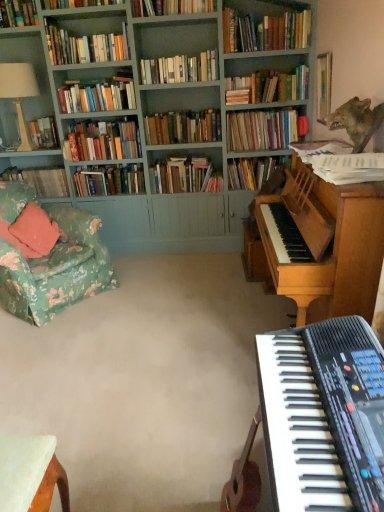
The image size is (384, 512). What do you see at coordinates (340, 162) in the screenshot?
I see `white paper at upper right, acting as the 1th book starting from the front` at bounding box center [340, 162].

The width and height of the screenshot is (384, 512). Find the location of `hardcover books at upper left, marked as the 11th book in a back-to-front arrangement`. hardcover books at upper left, marked as the 11th book in a back-to-front arrangement is located at coordinates (85, 46).

Image resolution: width=384 pixels, height=512 pixels. I want to click on hardcover book at left, which ranks as the first book in back-to-front order, so click(x=41, y=180).

Where is `hardcover book at center, marked as the eleventh book in a front-to-back arrangement`? Image resolution: width=384 pixels, height=512 pixels. hardcover book at center, marked as the eleventh book in a front-to-back arrangement is located at coordinates (253, 172).

Looking at this image, is white ceramic lamp at upper left with hardcover books at center, which ranks as the 6th book in front-to-back order?

No, white ceramic lamp at upper left is not beside hardcover books at center, which ranks as the 6th book in front-to-back order.

Is white ceramic lamp at upper left oriented towards hardcover books at center, which ranks as the 6th book in front-to-back order?

No.

Considering the relative sizes of white ceramic lamp at upper left and hardcover books at center, which is counted as the 9th book, starting from the back, in the image provided, is white ceramic lamp at upper left thinner than hardcover books at center, which is counted as the 9th book, starting from the back,?

In fact, white ceramic lamp at upper left might be wider than hardcover books at center, which is counted as the 9th book, starting from the back.

From the image's perspective, who appears lower, white ceramic lamp at upper left or hardcover books at center, which is counted as the 9th book, starting from the back?

white ceramic lamp at upper left, from the image's perspective.

In terms of width, does light brown polished wood piano at right look wider or thinner when compared to hardcover books at center, the tenth book viewed from the front?

light brown polished wood piano at right is wider than hardcover books at center, the tenth book viewed from the front.

Can you confirm if light brown polished wood piano at right is bigger than hardcover books at center, positioned as the 5th book in back-to-front order?

Yes, light brown polished wood piano at right is bigger than hardcover books at center, positioned as the 5th book in back-to-front order.

How many degrees apart are the facing directions of light brown polished wood piano at right and hardcover books at center, positioned as the 5th book in back-to-front order?

light brown polished wood piano at right and hardcover books at center, positioned as the 5th book in back-to-front order, are facing 91.1 degrees away from each other.

Is hardcover books at center, positioned as the 5th book in back-to-front order, surrounded by light brown polished wood piano at right?

No, light brown polished wood piano at right does not contain hardcover books at center, positioned as the 5th book in back-to-front order.

Consider the image. Which is closer, (x=298, y=173) or (x=149, y=9)?

Point (x=298, y=173) is positioned closer to the camera compared to point (x=149, y=9).

Is light brown polished wood piano at right wider than hardcover books at upper center, the 12th book in the back-to-front sequence?

Indeed, light brown polished wood piano at right has a greater width compared to hardcover books at upper center, the 12th book in the back-to-front sequence.

Is hardcover books at upper center, the third book viewed from the front, completely or partially inside light brown polished wood piano at right?

That's incorrect, hardcover books at upper center, the third book viewed from the front, is not inside light brown polished wood piano at right.

From the image's perspective, is light brown polished wood piano at right located above hardcover books at upper center, the third book viewed from the front?

No, from the image's perspective, light brown polished wood piano at right is not on top of hardcover books at upper center, the third book viewed from the front.

From a real-world perspective, is hardcover books at upper center, marked as the 7th book in a back-to-front arrangement, physically located above or below hardcover books at center, which is counted as the 9th book, starting from the back?

From a real-world perspective, hardcover books at upper center, marked as the 7th book in a back-to-front arrangement, is physically below hardcover books at center, which is counted as the 9th book, starting from the back.

Does hardcover books at upper center, which is the 8th book from front to back, have a lesser height compared to hardcover books at center, which ranks as the 6th book in front-to-back order?

Incorrect, the height of hardcover books at upper center, which is the 8th book from front to back, does not fall short of that of hardcover books at center, which ranks as the 6th book in front-to-back order.

Which is behind, hardcover books at upper center, which is the 8th book from front to back, or hardcover books at center, which ranks as the 6th book in front-to-back order?

hardcover books at upper center, which is the 8th book from front to back.

Is hardcover books at upper center, which is the 8th book from front to back, surrounding hardcover books at center, which is counted as the 9th book, starting from the back?

That's incorrect, hardcover books at center, which is counted as the 9th book, starting from the back, is not inside hardcover books at upper center, which is the 8th book from front to back.

How many degrees apart are the facing directions of hardcover book at center, marked as the eleventh book in a front-to-back arrangement, and hardcover books at upper left, the 9th book positioned from the front?

The angular difference between hardcover book at center, marked as the eleventh book in a front-to-back arrangement, and hardcover books at upper left, the 9th book positioned from the front, is 1.8 degrees.

Considering the relative sizes of hardcover book at center, marked as the eleventh book in a front-to-back arrangement, and hardcover books at upper left, the 9th book positioned from the front, in the image provided, is hardcover book at center, marked as the eleventh book in a front-to-back arrangement, wider than hardcover books at upper left, the 9th book positioned from the front,?

Indeed, hardcover book at center, marked as the eleventh book in a front-to-back arrangement, has a greater width compared to hardcover books at upper left, the 9th book positioned from the front.

Does hardcover book at center, marked as the eleventh book in a front-to-back arrangement, have a larger size compared to hardcover books at upper left, which is counted as the 6th book, starting from the back?

Yes, hardcover book at center, marked as the eleventh book in a front-to-back arrangement, is bigger than hardcover books at upper left, which is counted as the 6th book, starting from the back.

Is hardcover book at center, the 4th book in the back-to-front sequence, looking in the opposite direction of hardcover books at upper left, the 9th book positioned from the front?

That's not correct — hardcover book at center, the 4th book in the back-to-front sequence, is not looking away from hardcover books at upper left, the 9th book positioned from the front.

Is hardcover books at upper center, the third book viewed from the front, positioned beyond the bounds of hardcover book at left, which ranks as the first book in back-to-front order?

Absolutely, hardcover books at upper center, the third book viewed from the front, is external to hardcover book at left, which ranks as the first book in back-to-front order.

What's the angular difference between hardcover books at upper center, the third book viewed from the front, and hardcover book at left, acting as the 14th book starting from the front,'s facing directions?

There is a 0.0706-degree angle between the facing directions of hardcover books at upper center, the third book viewed from the front, and hardcover book at left, acting as the 14th book starting from the front.

Locate an element on the screen. the 12th book located beneath the hardcover books at upper center, the third book viewed from the front (from a real-world perspective) is located at coordinates (41, 180).

Considering the positions of objects hardcover books at upper center, the 12th book in the back-to-front sequence, and hardcover book at left, which ranks as the first book in back-to-front order, in the image provided, who is behind, hardcover books at upper center, the 12th book in the back-to-front sequence, or hardcover book at left, which ranks as the first book in back-to-front order,?

hardcover book at left, which ranks as the first book in back-to-front order, is further from the camera.

From the image's perspective, is white paper at upper right, acting as the 1th book starting from the front, above floral fabric chair at left?

Yes, from the image's perspective, white paper at upper right, acting as the 1th book starting from the front, is on top of floral fabric chair at left.

In the scene shown: Looking at the image, does white paper at upper right, which appears as the fourteenth book when viewed from the back, seem bigger or smaller compared to floral fabric chair at left?

Considering their sizes, white paper at upper right, which appears as the fourteenth book when viewed from the back, takes up less space than floral fabric chair at left.

Is point (362, 160) closer or farther from the camera than point (41, 311)?

Point (362, 160) appears to be closer to the viewer than point (41, 311).

Which object is further away from the camera taking this photo, white paper at upper right, acting as the 1th book starting from the front, or floral fabric chair at left?

floral fabric chair at left is behind.

Where is `lamp below the hardcover books at center, which is counted as the 9th book, starting from the back (from the image's perspective)`? This screenshot has width=384, height=512. lamp below the hardcover books at center, which is counted as the 9th book, starting from the back (from the image's perspective) is located at coordinates (19, 91).

In order to click on the 8th book above the light brown polished wood piano at right (from a real-world perspective) in this screenshot , I will do `click(183, 127)`.

From the picture: Estimate the real-world distances between objects in this image. Which object is further from hardcover books at center, acting as the third book starting from the back, hardcover book at center, the 4th book in the back-to-front sequence, or hardcover books at upper left, marked as the 11th book in a back-to-front arrangement?

hardcover books at upper left, marked as the 11th book in a back-to-front arrangement, is positioned further to the anchor hardcover books at center, acting as the third book starting from the back.

Which object lies further to the anchor point hardcover books at upper left, marked as the 11th book in a back-to-front arrangement, hardcover book at left, acting as the 14th book starting from the front, or shiny metallic wolf at upper right?

shiny metallic wolf at upper right.

Looking at the image, which one is located closer to floral fabric chair at left, hardcover books at center, the tenth book viewed from the front, or white paper at upper right, which appears as the fourteenth book when viewed from the back?

hardcover books at center, the tenth book viewed from the front, lies closer to floral fabric chair at left than the other object.

Looking at the image, which one is located further to hardcover books at center, the 2th book positioned from the back, light brown polished wood piano at right or hardcover books at upper left, the 9th book positioned from the front?

light brown polished wood piano at right lies further to hardcover books at center, the 2th book positioned from the back, than the other object.

Considering their positions, is hardcover books at upper center, marked as the 7th book in a back-to-front arrangement, positioned further to teal painted wood bookcase at upper left than light brown polished wood piano at right?

Among the two, light brown polished wood piano at right is located further to teal painted wood bookcase at upper left.

Which object lies further to the anchor point hardcover books at center, the 2th book positioned from the back, shiny metallic wolf at upper right or teal painted wood bookcase at upper left?

Based on the image, shiny metallic wolf at upper right appears to be further to hardcover books at center, the 2th book positioned from the back.

From the image, which object appears to be farther from hardcover books at upper left, which is counted as the 6th book, starting from the back, hardcover book at center, marked as the eleventh book in a front-to-back arrangement, or white ceramic lamp at upper left?

hardcover book at center, marked as the eleventh book in a front-to-back arrangement, is positioned further to the anchor hardcover books at upper left, which is counted as the 6th book, starting from the back.

Based on their spatial positions, is hardcover books at upper center, which is the 8th book from front to back, or teal painted wood bookcase at upper left closer to hardcover books at center, the 13th book when ordered from front to back?

Based on the image, teal painted wood bookcase at upper left appears to be nearer to hardcover books at center, the 13th book when ordered from front to back.

Identify the location of bookcase located between floral fabric chair at left and hardcover book at left, which ranks as the first book in back-to-front order, in the depth direction. This screenshot has width=384, height=512. (143, 124).

Where is `piano between black plastic keyboard at lower right and hardcover books at upper center, which is the second book in front-to-back order, in the front-back direction`? The width and height of the screenshot is (384, 512). piano between black plastic keyboard at lower right and hardcover books at upper center, which is the second book in front-to-back order, in the front-back direction is located at coordinates (329, 244).

The width and height of the screenshot is (384, 512). In order to click on bookcase between hardcover books at center, which is counted as the 9th book, starting from the back, and hardcover books at center, the 2th book positioned from the back, from top to bottom in this screenshot , I will do `click(143, 124)`.

This screenshot has width=384, height=512. What are the coordinates of `chair between black plastic keyboard at lower right and hardcover books at upper center, which is the 13th book from back to front, from front to back` in the screenshot? It's located at [x=48, y=255].